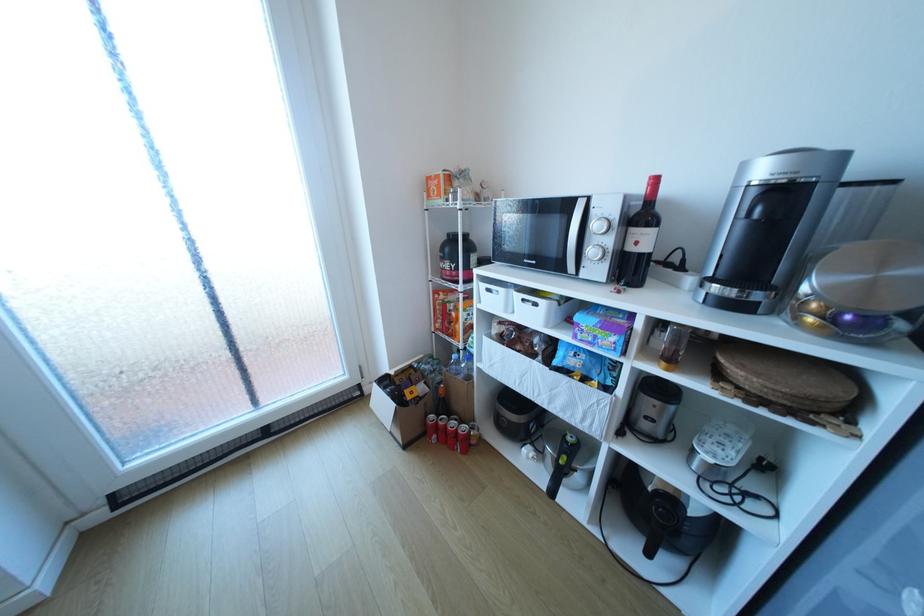
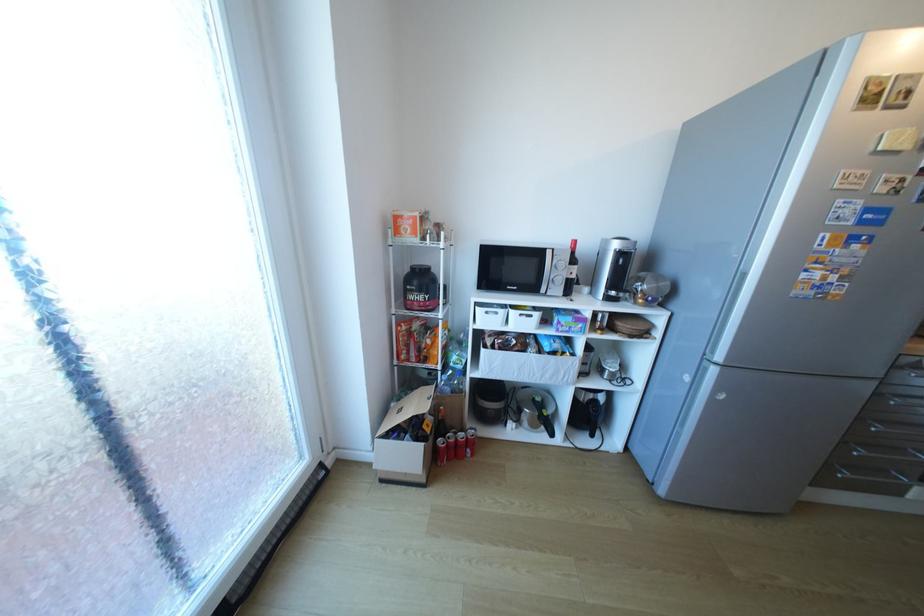
In the second image, find the point that corresponds to (x=544, y=304) in the first image.

(540, 315)